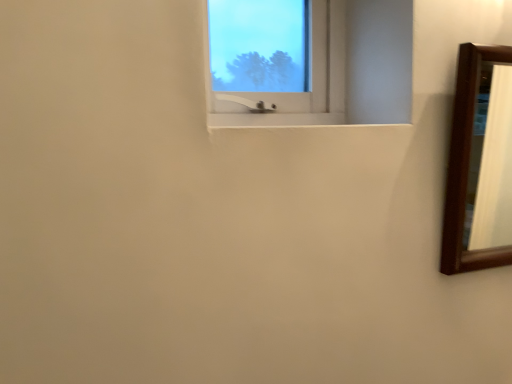
Question: Does transparent glass window at upper center have a larger size compared to brown wooden mirror at right?

Choices:
 (A) yes
 (B) no

Answer: (B)

Question: Does transparent glass window at upper center come in front of brown wooden mirror at right?

Choices:
 (A) no
 (B) yes

Answer: (B)

Question: Does transparent glass window at upper center have a lesser height compared to brown wooden mirror at right?

Choices:
 (A) yes
 (B) no

Answer: (A)

Question: Is transparent glass window at upper center oriented towards brown wooden mirror at right?

Choices:
 (A) yes
 (B) no

Answer: (B)

Question: Does transparent glass window at upper center have a greater height compared to brown wooden mirror at right?

Choices:
 (A) yes
 (B) no

Answer: (B)

Question: Considering the relative sizes of transparent glass window at upper center and brown wooden mirror at right in the image provided, is transparent glass window at upper center smaller than brown wooden mirror at right?

Choices:
 (A) yes
 (B) no

Answer: (A)

Question: Does brown wooden mirror at right appear on the left side of transparent glass window at upper center?

Choices:
 (A) no
 (B) yes

Answer: (A)

Question: Is brown wooden mirror at right aimed at transparent glass window at upper center?

Choices:
 (A) yes
 (B) no

Answer: (B)

Question: From a real-world perspective, is brown wooden mirror at right over transparent glass window at upper center?

Choices:
 (A) no
 (B) yes

Answer: (A)

Question: Is brown wooden mirror at right further to the viewer compared to transparent glass window at upper center?

Choices:
 (A) yes
 (B) no

Answer: (A)

Question: Can you confirm if brown wooden mirror at right is smaller than transparent glass window at upper center?

Choices:
 (A) yes
 (B) no

Answer: (B)

Question: Does brown wooden mirror at right have a greater width compared to transparent glass window at upper center?

Choices:
 (A) yes
 (B) no

Answer: (A)

Question: In terms of size, does transparent glass window at upper center appear bigger or smaller than brown wooden mirror at right?

Choices:
 (A) small
 (B) big

Answer: (A)